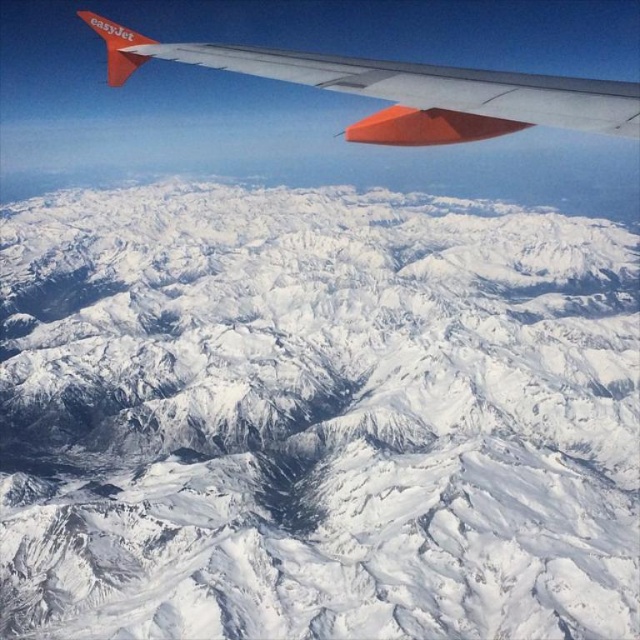
Question: Which point is farther from the camera taking this photo?

Choices:
 (A) (356, 84)
 (B) (380, 429)

Answer: (B)

Question: Does snowy rocky mountain range at center lie behind matte orange wing at upper left?

Choices:
 (A) no
 (B) yes

Answer: (B)

Question: Does snowy rocky mountain range at center have a smaller size compared to matte orange wing at upper left?

Choices:
 (A) yes
 (B) no

Answer: (A)

Question: Does snowy rocky mountain range at center appear on the left side of matte orange wing at upper left?

Choices:
 (A) yes
 (B) no

Answer: (B)

Question: Which point appears closest to the camera in this image?

Choices:
 (A) (438, 90)
 (B) (420, 400)

Answer: (A)